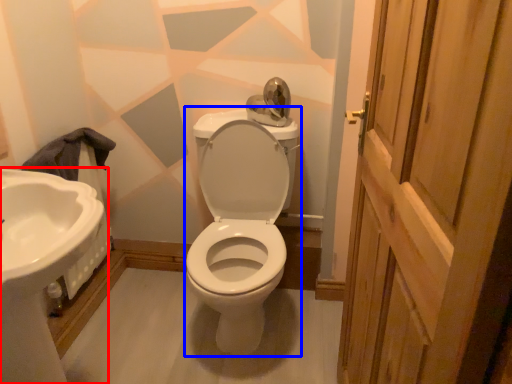
Question: Which point is closer to the camera, sink (highlighted by a red box) or porcelain (highlighted by a blue box)?

Choices:
 (A) sink
 (B) porcelain

Answer: (A)